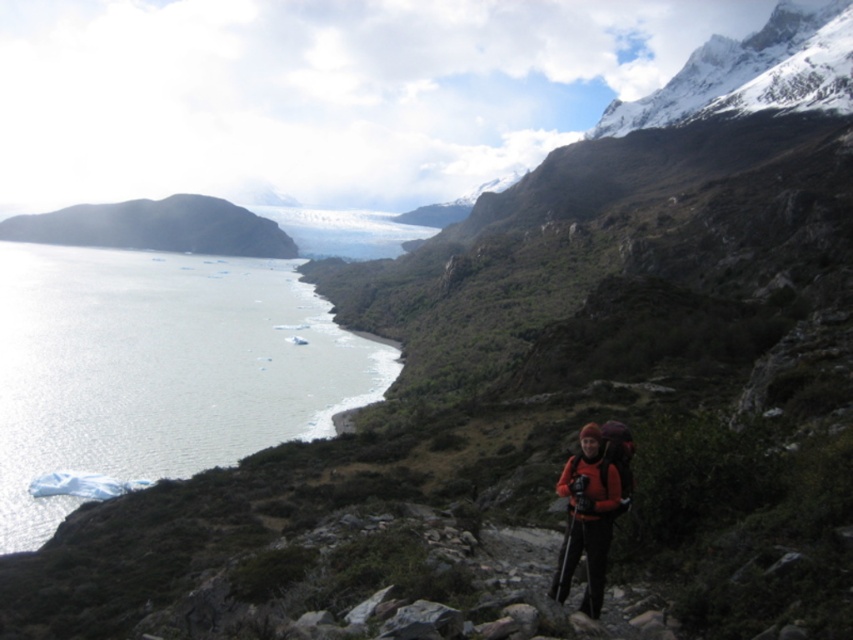
Question: Does clear water at left appear over orange fleece jacket at center?

Choices:
 (A) yes
 (B) no

Answer: (A)

Question: Which point is farther to the camera?

Choices:
 (A) (570, 524)
 (B) (97, 435)

Answer: (B)

Question: Among these objects, which one is farthest from the camera?

Choices:
 (A) orange fleece jacket at center
 (B) clear water at left

Answer: (B)

Question: Which point appears farthest from the camera in this image?

Choices:
 (A) (97, 352)
 (B) (599, 465)

Answer: (A)

Question: From the image, what is the correct spatial relationship of clear water at left in relation to orange fleece jacket at center?

Choices:
 (A) below
 (B) above

Answer: (B)

Question: Is clear water at left thinner than orange fleece jacket at center?

Choices:
 (A) yes
 (B) no

Answer: (B)